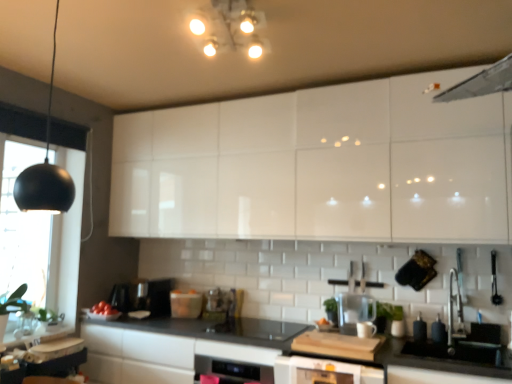
Locate an element on the screen. free location to the right of matte black soap dispenser at lower right, placed as the first appliance when sorted from front to back is located at coordinates (446, 339).